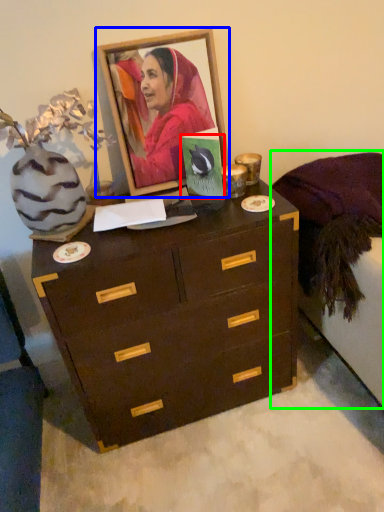
Question: Estimate the real-world distances between objects in this image. Which object is closer to postcard (highlighted by a red box), picture frame (highlighted by a blue box) or bed frame (highlighted by a green box)?

Choices:
 (A) picture frame
 (B) bed frame

Answer: (A)